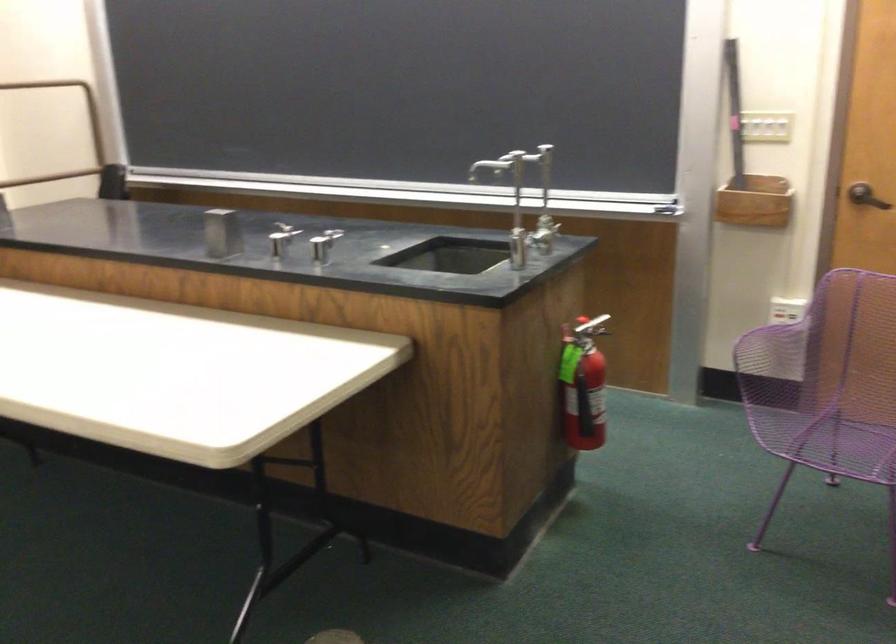
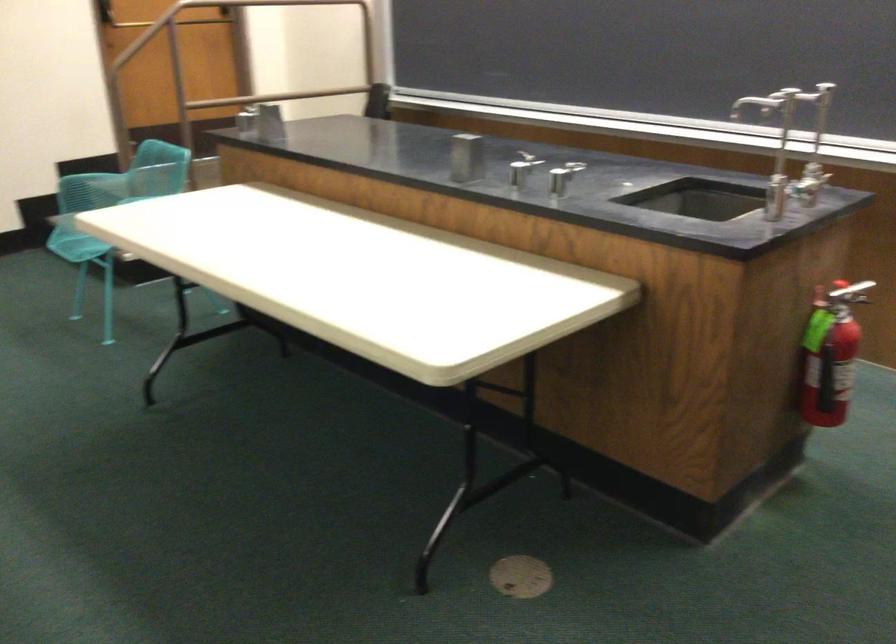
The images are taken continuously from a first-person perspective. In which direction are you moving?

The cameraman moved toward right, forward.